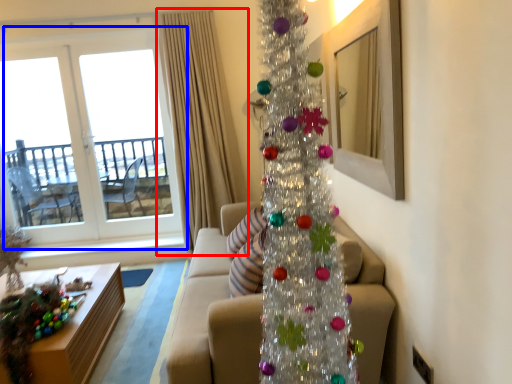
Question: Among these objects, which one is farthest to the camera, curtain (highlighted by a red box) or window (highlighted by a blue box)?

Choices:
 (A) curtain
 (B) window

Answer: (B)